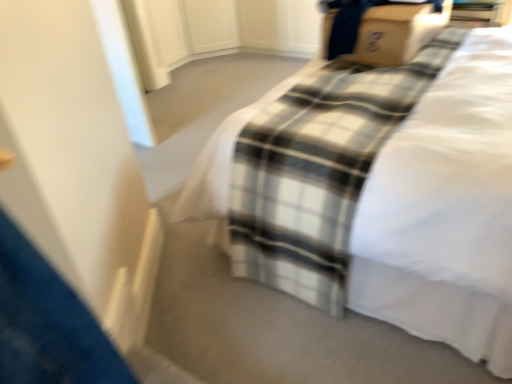
Locate an element on the screen. The image size is (512, 384). free spot in front of cardboard box at upper right is located at coordinates (374, 86).